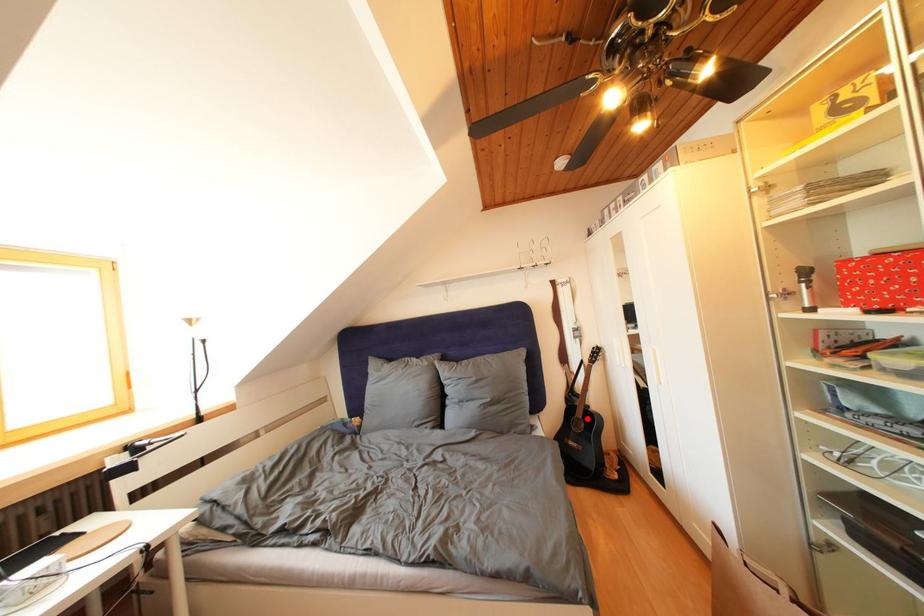
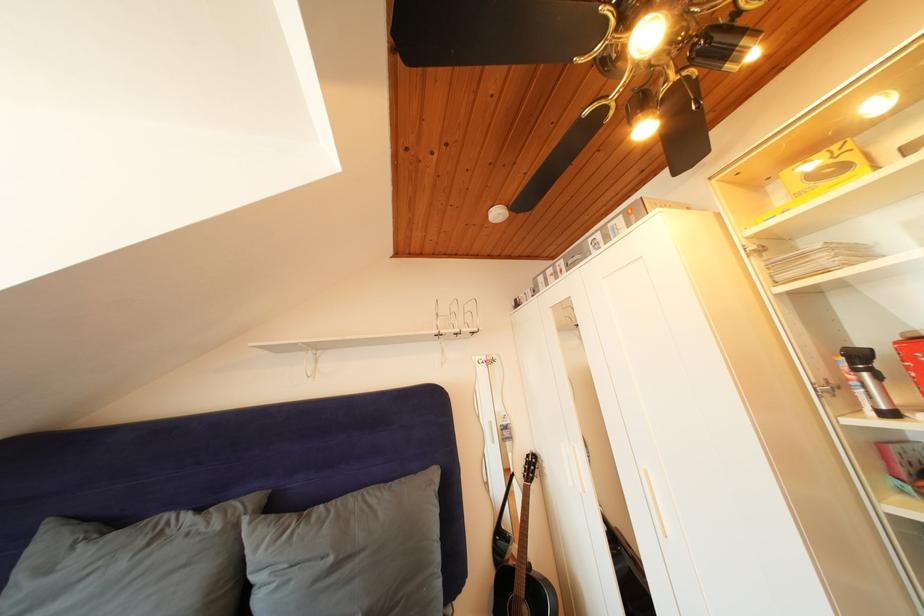
Find the pixel in the second image that matches the highlighted location in the first image.

(528, 592)